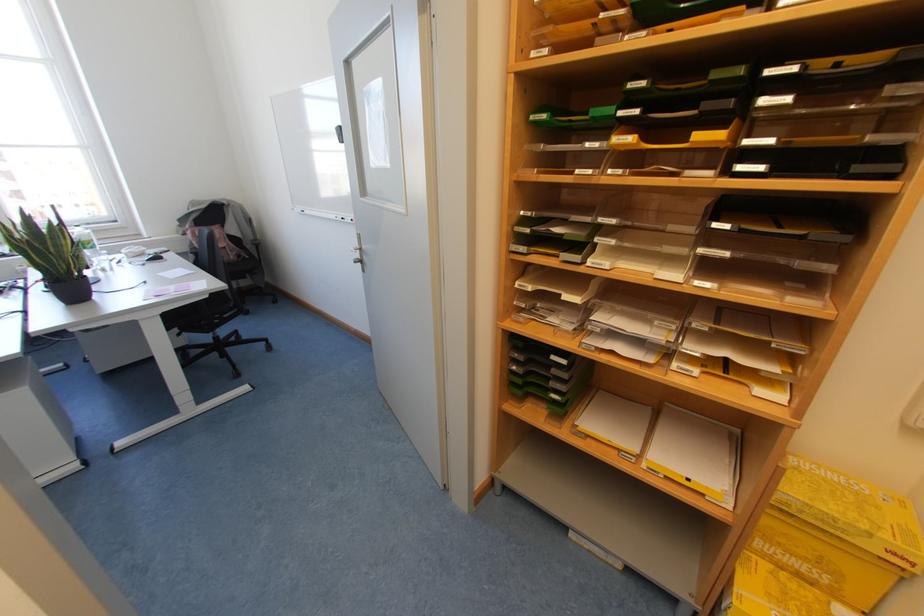
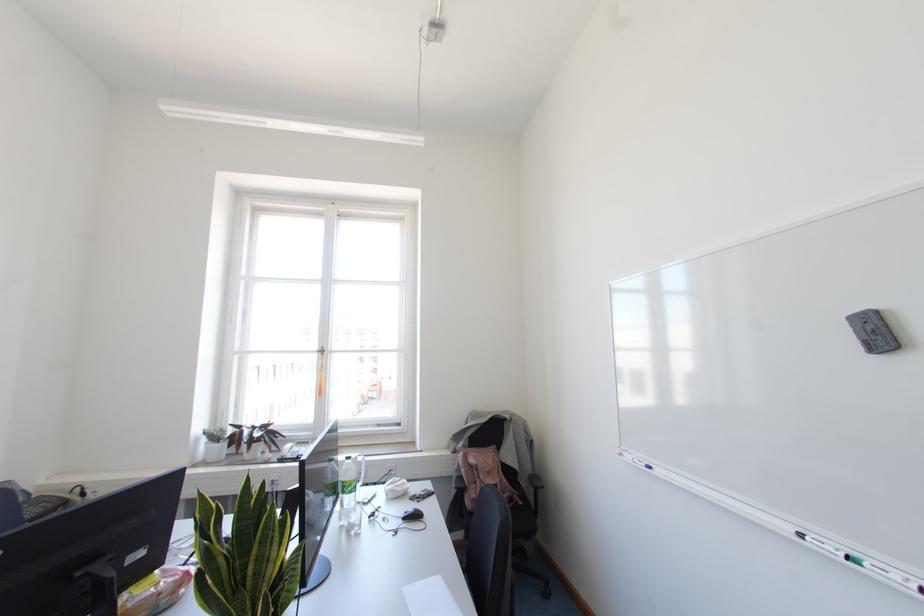
The point at (82,244) is marked in the first image. Where is the corresponding point in the second image?

(343, 485)